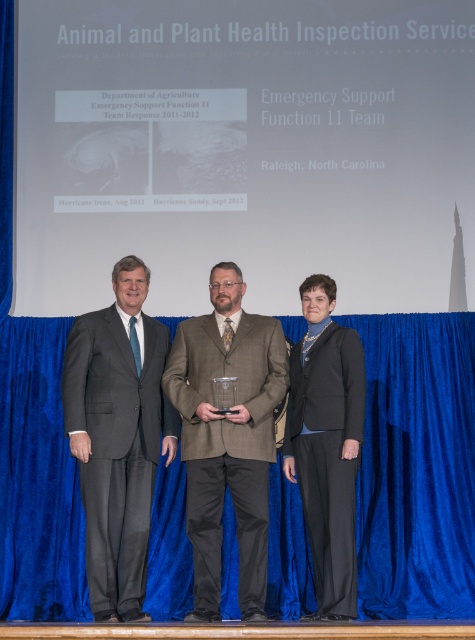
Question: Observing the image, what is the correct spatial positioning of gray suit at left in reference to brown wool suit at center?

Choices:
 (A) right
 (B) left

Answer: (B)

Question: Does blue velvet curtain at center lie behind black fabric suit at center?

Choices:
 (A) yes
 (B) no

Answer: (A)

Question: Which object appears closest to the camera in this image?

Choices:
 (A) black fabric suit at center
 (B) gray suit at left

Answer: (B)

Question: Where is blue velvet curtain at center located in relation to gray suit at left in the image?

Choices:
 (A) left
 (B) right

Answer: (A)

Question: Among these points, which one is nearest to the camera?

Choices:
 (A) (152, 324)
 (B) (21, 444)

Answer: (A)

Question: Which of the following is the closest to the observer?

Choices:
 (A) brown wool suit at center
 (B) black fabric suit at center

Answer: (A)